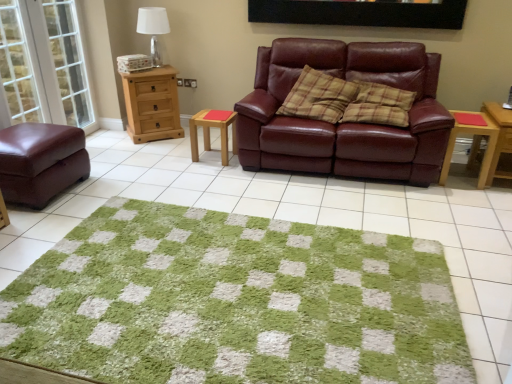
Question: Is transparent glass door at left, placed as the 2th glass door when sorted from left to right, further to the viewer compared to black matte picture frame at upper center?

Choices:
 (A) yes
 (B) no

Answer: (A)

Question: Could you tell me if transparent glass door at left, placed as the 2th glass door when sorted from left to right, is turned towards black matte picture frame at upper center?

Choices:
 (A) no
 (B) yes

Answer: (B)

Question: Is black matte picture frame at upper center at the back of transparent glass door at left, the 1th glass door in the right-to-left sequence?

Choices:
 (A) yes
 (B) no

Answer: (B)

Question: Is transparent glass door at left, the 1th glass door in the right-to-left sequence, shorter than black matte picture frame at upper center?

Choices:
 (A) no
 (B) yes

Answer: (A)

Question: From a real-world perspective, is transparent glass door at left, the 1th glass door in the right-to-left sequence, under black matte picture frame at upper center?

Choices:
 (A) no
 (B) yes

Answer: (B)

Question: Does transparent glass door at left, placed as the 2th glass door when sorted from left to right, have a lesser width compared to black matte picture frame at upper center?

Choices:
 (A) yes
 (B) no

Answer: (B)

Question: Is green shaggy rug at center facing away from white fabric lampshade at upper left?

Choices:
 (A) no
 (B) yes

Answer: (A)

Question: Is green shaggy rug at center next to white fabric lampshade at upper left?

Choices:
 (A) no
 (B) yes

Answer: (A)

Question: From a real-world perspective, is green shaggy rug at center located beneath white fabric lampshade at upper left?

Choices:
 (A) no
 (B) yes

Answer: (B)

Question: Does green shaggy rug at center lie in front of white fabric lampshade at upper left?

Choices:
 (A) yes
 (B) no

Answer: (A)

Question: Can you confirm if green shaggy rug at center is positioned to the right of white fabric lampshade at upper left?

Choices:
 (A) no
 (B) yes

Answer: (B)

Question: Does green shaggy rug at center have a greater width compared to white fabric lampshade at upper left?

Choices:
 (A) no
 (B) yes

Answer: (B)

Question: Can you confirm if natural wood chest of drawers at left is shorter than white fabric lampshade at upper left?

Choices:
 (A) yes
 (B) no

Answer: (B)